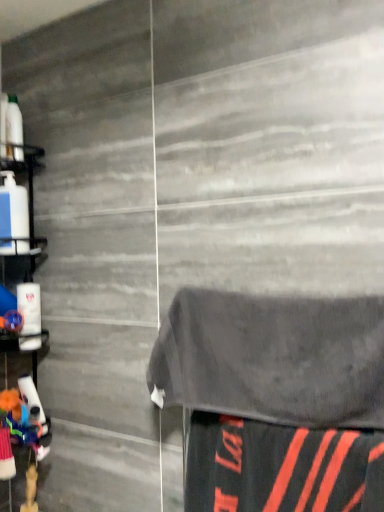
Question: From the image's perspective, is white plastic shelf at left above or below black matte fabric at lower right?

Choices:
 (A) below
 (B) above

Answer: (B)

Question: Looking at the image, does white plastic shelf at left seem bigger or smaller compared to black matte fabric at lower right?

Choices:
 (A) small
 (B) big

Answer: (B)

Question: Which object is positioned closest to the black matte fabric at lower right?

Choices:
 (A) white plastic shelf at left
 (B) dark gray towel at center

Answer: (B)

Question: Which of these objects is positioned closest to the dark gray towel at center?

Choices:
 (A) black matte fabric at lower right
 (B) white plastic shelf at left

Answer: (A)